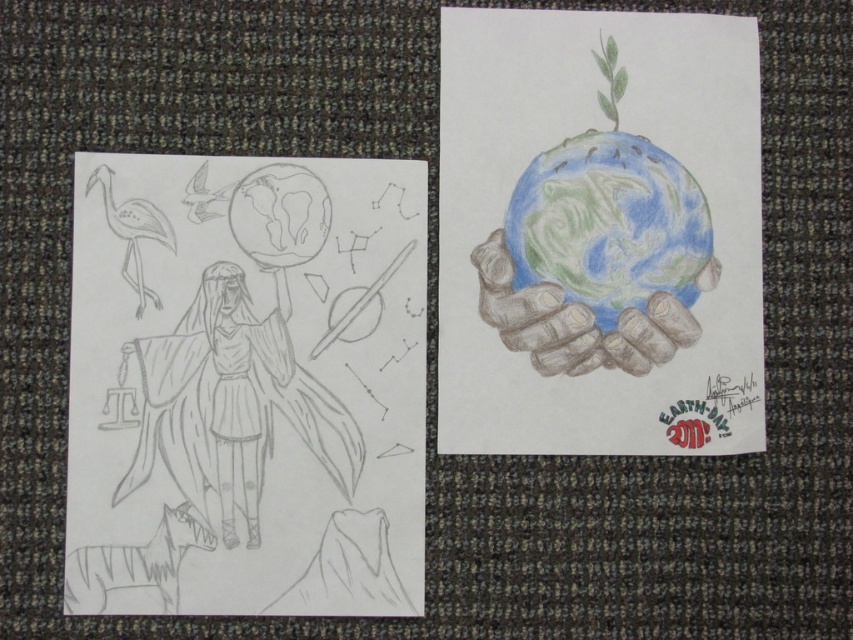
Question: Estimate the real-world distances between objects in this image. Which object is farther from the colored pencil hands at center?

Choices:
 (A) pencil sketch of figure holding globe at center
 (B) pastel colored globe at center

Answer: (A)

Question: Is pastel colored globe at center closer to camera compared to colored pencil hands at center?

Choices:
 (A) yes
 (B) no

Answer: (B)

Question: Does pencil sketch of figure holding globe at center have a smaller size compared to pastel colored globe at center?

Choices:
 (A) yes
 (B) no

Answer: (B)

Question: Which object is the farthest from the pencil sketch of figure holding globe at center?

Choices:
 (A) pastel colored globe at center
 (B) colored pencil hands at center

Answer: (A)

Question: Is pastel colored globe at center bigger than colored pencil hands at center?

Choices:
 (A) no
 (B) yes

Answer: (B)

Question: Which object appears farthest from the camera in this image?

Choices:
 (A) colored pencil hands at center
 (B) pencil sketch of figure holding globe at center

Answer: (A)